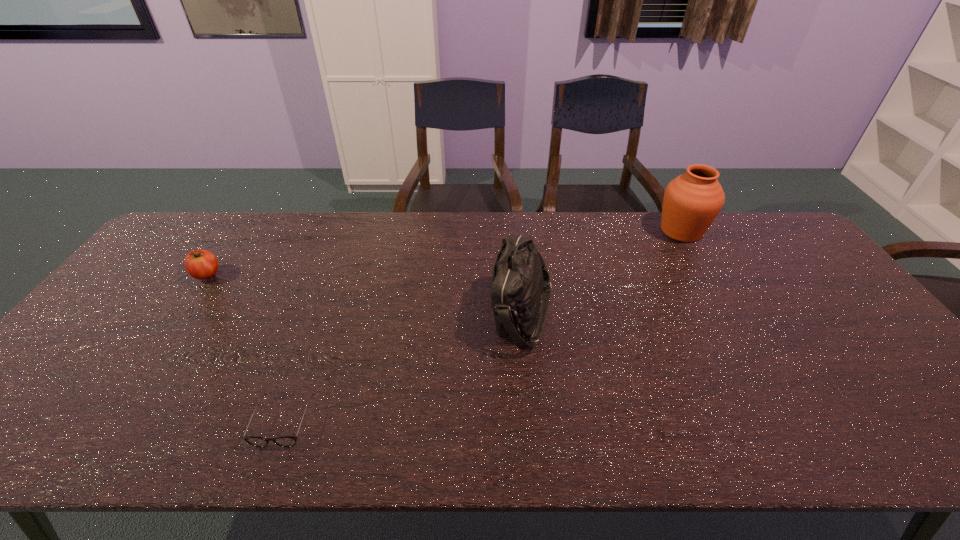
You are a GUI agent. You are given a task and a screenshot of the screen. Output one action in this format:
    pyautogui.click(x=<x>, y=<y>)
    Task: Click on the vacant space positioned at the front padded panel of the third object from left to right
    This screenshot has height=540, width=960.
    Given the screenshot: What is the action you would take?
    pyautogui.click(x=439, y=313)

Identify the location of vacant space located on the front of the leftmost object. (174, 323).

At what (x,y) coordinates should I click in order to perform the action: click on object situated at the far edge. Please return your answer as a coordinate pair (x, y). Looking at the image, I should click on (692, 201).

The image size is (960, 540). I want to click on object positioned at the near edge, so click(x=284, y=441).

Identify the location of vacant space at the far edge of the desktop. (260, 227).

Locate an element on the screen. This screenshot has height=540, width=960. free space at the near edge of the desktop is located at coordinates (143, 437).

At what (x,y) coordinates should I click in order to perform the action: click on vacant area at the left edge of the desktop. Please return your answer as a coordinate pair (x, y). Looking at the image, I should click on (136, 286).

This screenshot has width=960, height=540. Find the location of `empty space between the second shortest object and the third object from left to right`. empty space between the second shortest object and the third object from left to right is located at coordinates (365, 294).

Find the location of `vacant space that is in between the third object from left to right and the spectacles`. vacant space that is in between the third object from left to right and the spectacles is located at coordinates (403, 367).

Where is `free space between the nearest object and the third object from left to right`? This screenshot has height=540, width=960. free space between the nearest object and the third object from left to right is located at coordinates (403, 367).